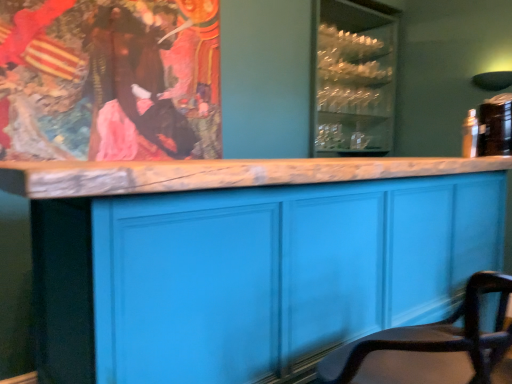
Question: Considering the relative sizes of brown velvet robe at upper left and smooth leather chair at lower right in the image provided, is brown velvet robe at upper left smaller than smooth leather chair at lower right?

Choices:
 (A) yes
 (B) no

Answer: (A)

Question: Is brown velvet robe at upper left taller than smooth leather chair at lower right?

Choices:
 (A) yes
 (B) no

Answer: (A)

Question: From the image's perspective, does brown velvet robe at upper left appear lower than smooth leather chair at lower right?

Choices:
 (A) yes
 (B) no

Answer: (B)

Question: From the image's perspective, is brown velvet robe at upper left over smooth leather chair at lower right?

Choices:
 (A) no
 (B) yes

Answer: (B)

Question: From a real-world perspective, is brown velvet robe at upper left positioned under smooth leather chair at lower right based on gravity?

Choices:
 (A) yes
 (B) no

Answer: (B)

Question: Is brown velvet robe at upper left not near smooth leather chair at lower right?

Choices:
 (A) yes
 (B) no

Answer: (A)

Question: From the image's perspective, is clear glass cabinet at upper center over brown velvet robe at upper left?

Choices:
 (A) yes
 (B) no

Answer: (A)

Question: Is clear glass cabinet at upper center closer to the viewer compared to brown velvet robe at upper left?

Choices:
 (A) yes
 (B) no

Answer: (B)

Question: Is clear glass cabinet at upper center at the right side of brown velvet robe at upper left?

Choices:
 (A) no
 (B) yes

Answer: (B)

Question: Could you tell me if clear glass cabinet at upper center is turned towards brown velvet robe at upper left?

Choices:
 (A) yes
 (B) no

Answer: (B)

Question: Is clear glass cabinet at upper center located outside brown velvet robe at upper left?

Choices:
 (A) yes
 (B) no

Answer: (A)

Question: Is clear glass cabinet at upper center smaller than brown velvet robe at upper left?

Choices:
 (A) yes
 (B) no

Answer: (B)

Question: Considering the relative sizes of clear glass cabinet at upper center and matte blue cabinet at center in the image provided, is clear glass cabinet at upper center smaller than matte blue cabinet at center?

Choices:
 (A) no
 (B) yes

Answer: (B)